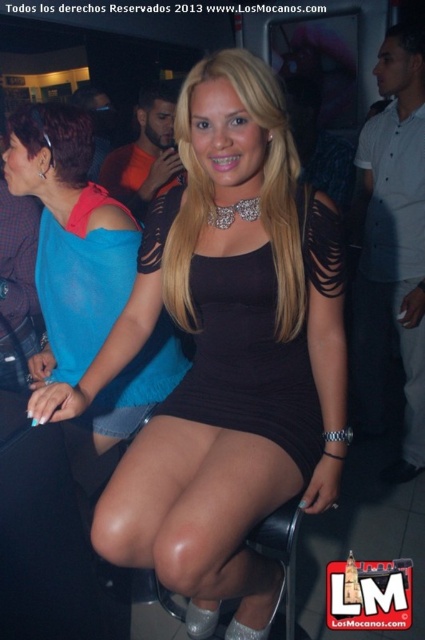
Which of these two, blue sheer top at upper left or black ribbed dress at center, stands taller?

With more height is blue sheer top at upper left.

Does blue sheer top at upper left come in front of black ribbed dress at center?

That is False.

Is point (31, 368) positioned before point (305, 378)?

No.

Identify the location of blue sheer top at upper left. This screenshot has width=425, height=640. (70, 236).

Measure the distance from black matte dress at center to blue sheer top at upper left.

They are 41.29 centimeters apart.

Is black matte dress at center above blue sheer top at upper left?

No.

Does point (183, 292) come behind point (39, 244)?

No, it is not.

You are a GUI agent. You are given a task and a screenshot of the screen. Output one action in this format:
    pyautogui.click(x=<x>, y=<y>)
    Task: Click on the black matte dress at center
    Image resolution: width=425 pixels, height=640 pixels.
    Given the screenshot: What is the action you would take?
    pyautogui.click(x=235, y=355)

Is point (116, 492) in front of point (200, 301)?

Yes.

Measure the distance between black matte dress at center and camera.

black matte dress at center is 37.42 inches away from camera.

Measure the distance between point (263, 340) and camera.

The distance of point (263, 340) from camera is 1.21 meters.

You are a GUI agent. You are given a task and a screenshot of the screen. Output one action in this format:
    pyautogui.click(x=<x>, y=<y>)
    Task: Click on the black matte dress at center
    The height and width of the screenshot is (640, 425).
    Given the screenshot: What is the action you would take?
    pyautogui.click(x=235, y=355)